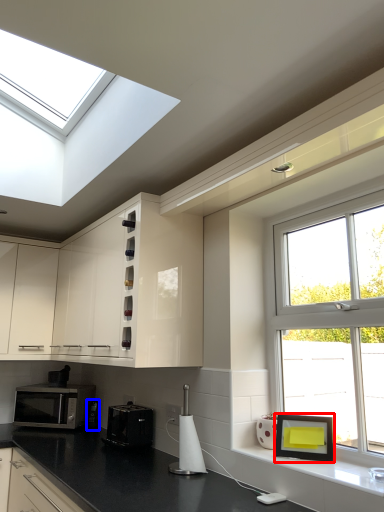
Question: Which of the following is the closest to the observer, picture frame (highlighted by a red box) or appliance (highlighted by a blue box)?

Choices:
 (A) picture frame
 (B) appliance

Answer: (A)